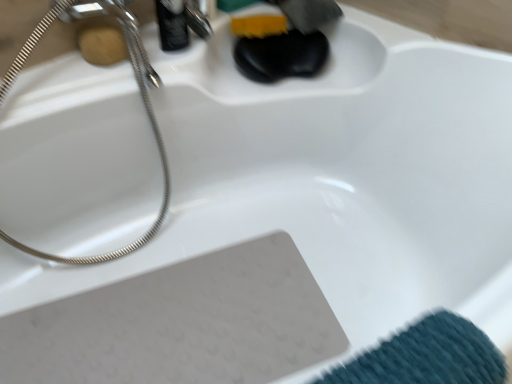
Question: From a real-world perspective, is polished chrome faucet at upper center over satin nickel shower head at upper left?

Choices:
 (A) yes
 (B) no

Answer: (A)

Question: Is polished chrome faucet at upper center not within satin nickel shower head at upper left?

Choices:
 (A) yes
 (B) no

Answer: (A)

Question: Does polished chrome faucet at upper center contain satin nickel shower head at upper left?

Choices:
 (A) no
 (B) yes

Answer: (A)

Question: Can you confirm if polished chrome faucet at upper center is shorter than satin nickel shower head at upper left?

Choices:
 (A) no
 (B) yes

Answer: (B)

Question: Does polished chrome faucet at upper center have a smaller size compared to satin nickel shower head at upper left?

Choices:
 (A) yes
 (B) no

Answer: (A)

Question: Is polished chrome faucet at upper center turned away from satin nickel shower head at upper left?

Choices:
 (A) yes
 (B) no

Answer: (B)

Question: Can you confirm if wooden soap at upper left is positioned to the left of polished chrome faucet at upper center?

Choices:
 (A) yes
 (B) no

Answer: (A)

Question: From a real-world perspective, is wooden soap at upper left beneath polished chrome faucet at upper center?

Choices:
 (A) yes
 (B) no

Answer: (A)

Question: Is wooden soap at upper left positioned in front of polished chrome faucet at upper center?

Choices:
 (A) no
 (B) yes

Answer: (B)

Question: From the image's perspective, is wooden soap at upper left beneath polished chrome faucet at upper center?

Choices:
 (A) yes
 (B) no

Answer: (A)

Question: From a real-world perspective, is wooden soap at upper left over polished chrome faucet at upper center?

Choices:
 (A) no
 (B) yes

Answer: (A)

Question: Is wooden soap at upper left further to the viewer compared to polished chrome faucet at upper center?

Choices:
 (A) yes
 (B) no

Answer: (B)

Question: Is wooden soap at upper left facing away from satin nickel shower head at upper left?

Choices:
 (A) yes
 (B) no

Answer: (A)